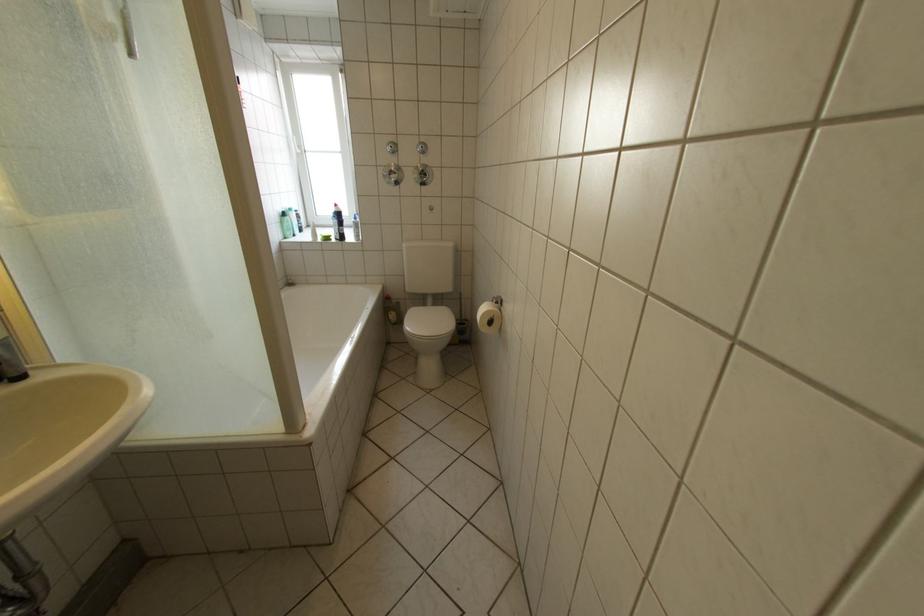
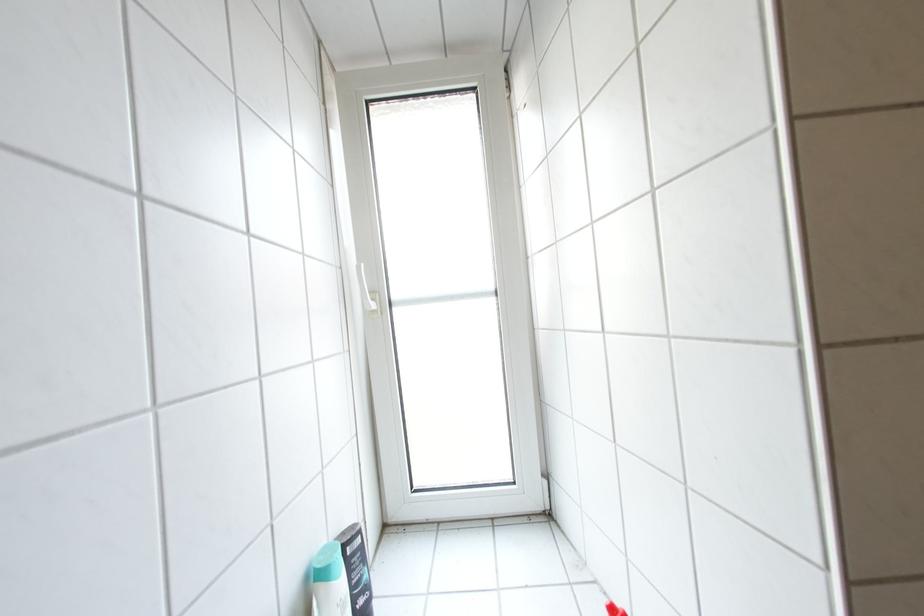
The images are taken continuously from a first-person perspective. In which direction are you moving?

The cameraman walked toward left, forward.